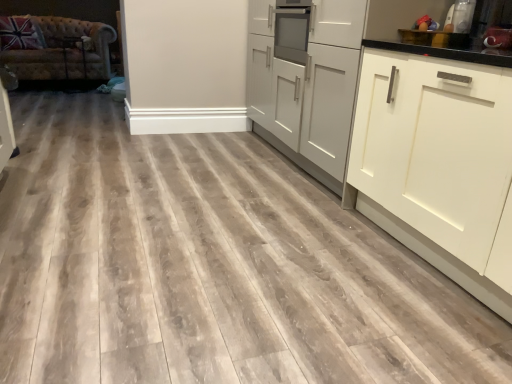
Question: From a real-world perspective, is white matte cabinet at right, arranged as the 2th cabinetry when viewed from the left, above or below metallic silver toaster at upper right, which is counted as the 1th appliance, starting from the left?

Choices:
 (A) above
 (B) below

Answer: (B)

Question: Is white matte cabinet at right, arranged as the 2th cabinetry when viewed from the left, inside the boundaries of metallic silver toaster at upper right, the second appliance in the right-to-left sequence, or outside?

Choices:
 (A) inside
 (B) outside

Answer: (B)

Question: Which of these objects is positioned closest to the metallic silver toaster at upper right, which is counted as the 1th appliance, starting from the left?

Choices:
 (A) tufted leather couch at left
 (B) metallic silver toaster at upper right, the 2th appliance positioned from the left
 (C) white matte cabinet at right, positioned as the 1th cabinetry in right-to-left order
 (D) matte gray cabinets at center, the first cabinetry in the left-to-right sequence

Answer: (B)

Question: Which object is positioned farthest from the metallic silver toaster at upper right, which appears as the first appliance when viewed from the right?

Choices:
 (A) matte gray cabinets at center, the 2th cabinetry from the right
 (B) metallic silver toaster at upper right, which is counted as the 1th appliance, starting from the left
 (C) white matte cabinet at right, positioned as the 1th cabinetry in right-to-left order
 (D) tufted leather couch at left

Answer: (D)